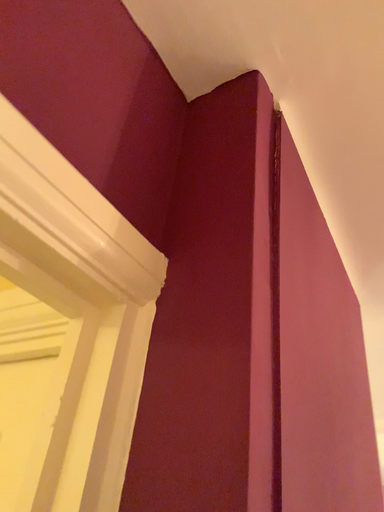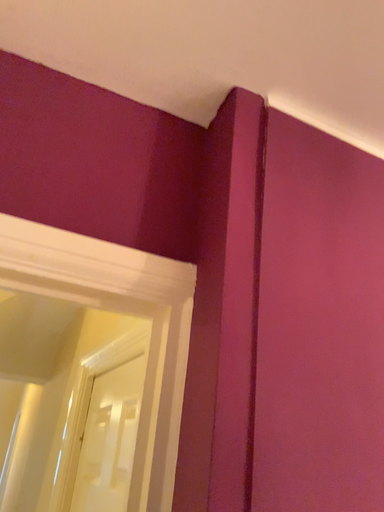
Question: How did the camera likely rotate when shooting the video?

Choices:
 (A) rotated downward
 (B) rotated upward

Answer: (A)